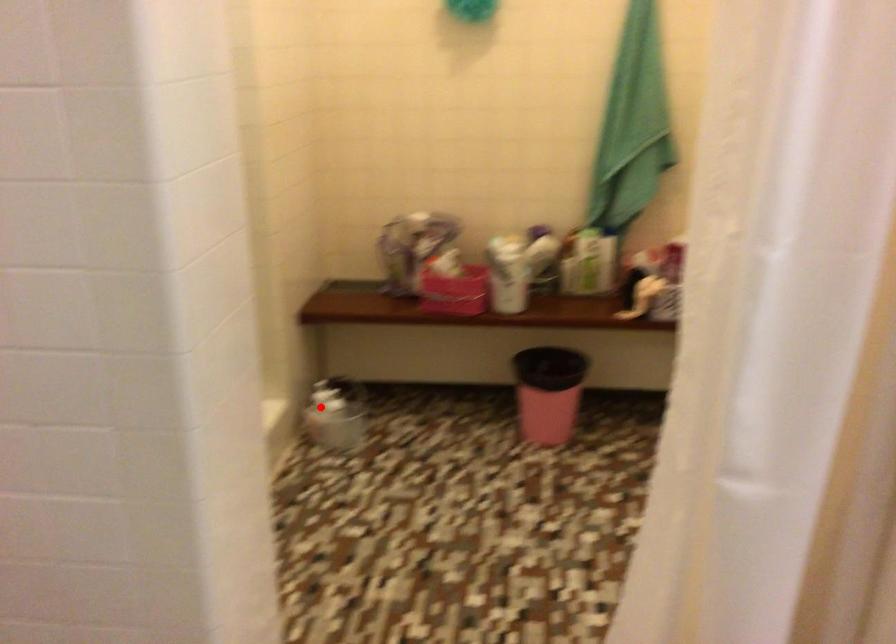
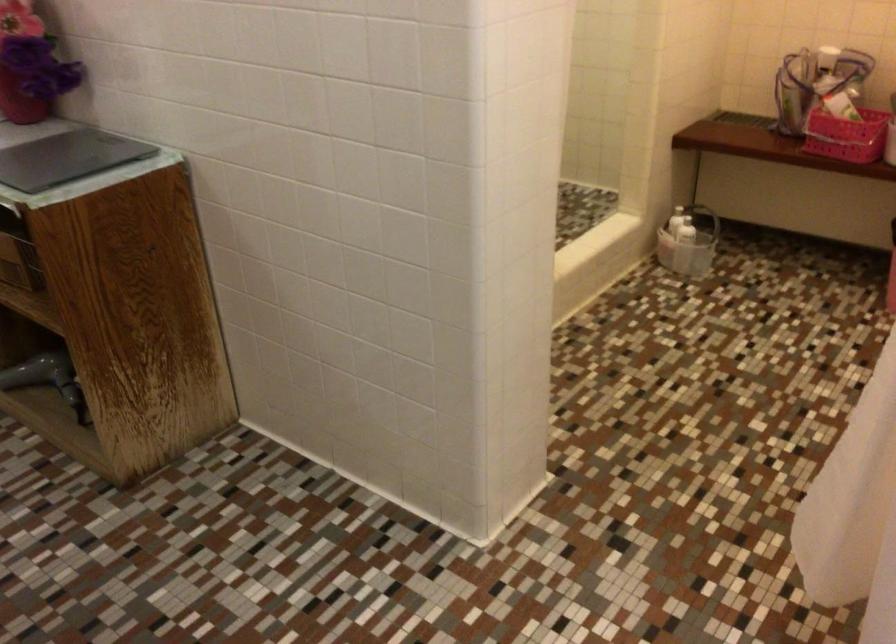
Where in the second image is the point corresponding to the highlighted location from the first image?

(678, 220)